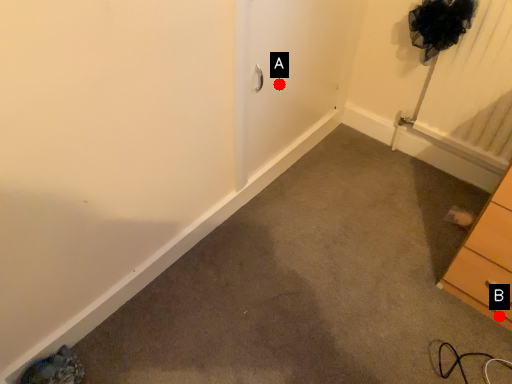
Question: Two points are circled on the image, labeled by A and B beside each circle. Which point is closer to the camera?

Choices:
 (A) A is closer
 (B) B is closer

Answer: (B)